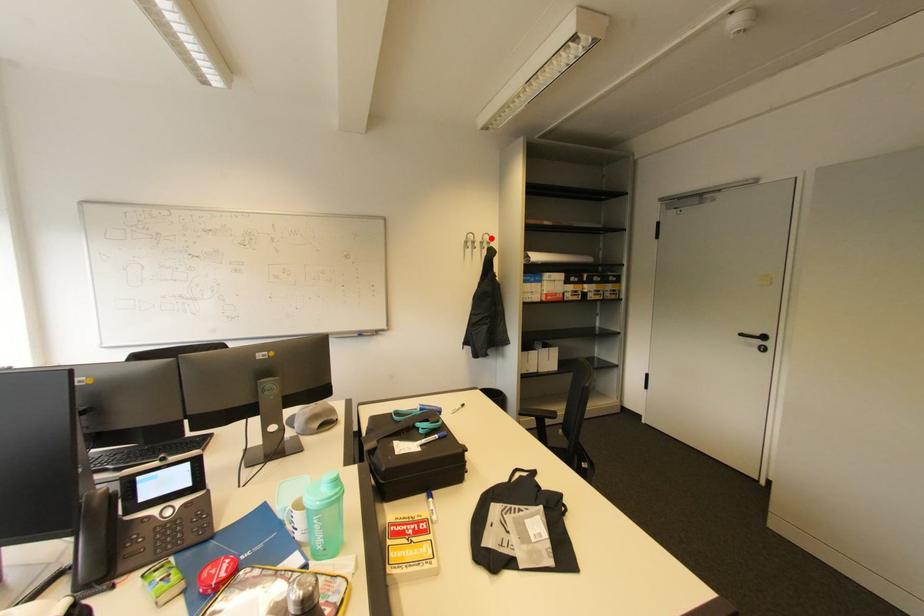
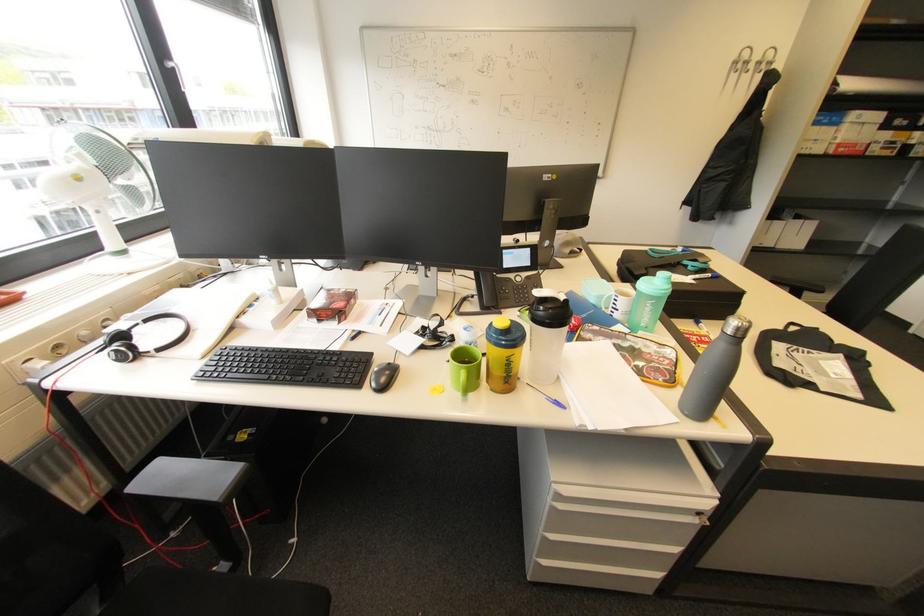
Question: I am providing you with two images of the same scene from different viewpoints. A red point is shown in image1. For the corresponding object point in image2, is it positioned nearer or farther from the camera?

Choices:
 (A) Nearer
 (B) Farther

Answer: (B)